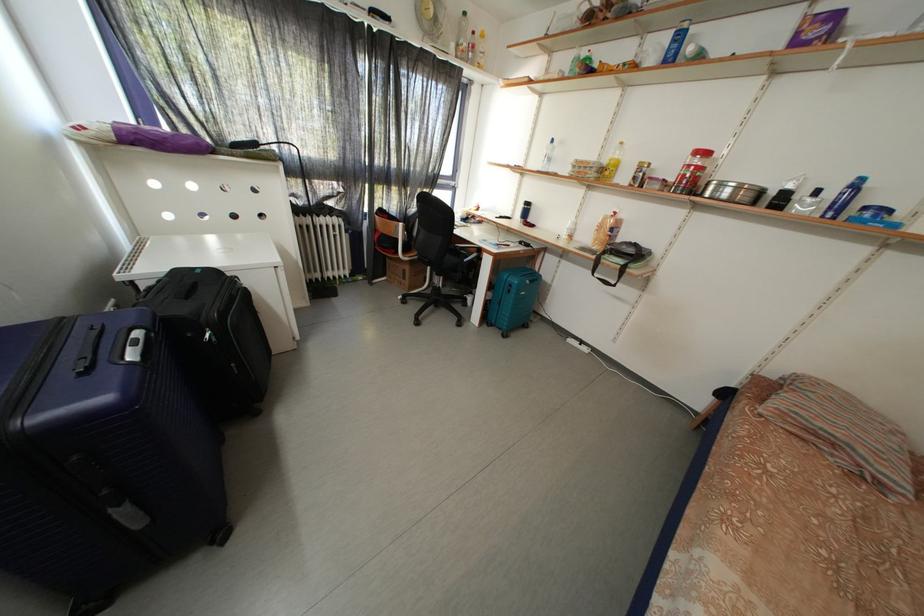
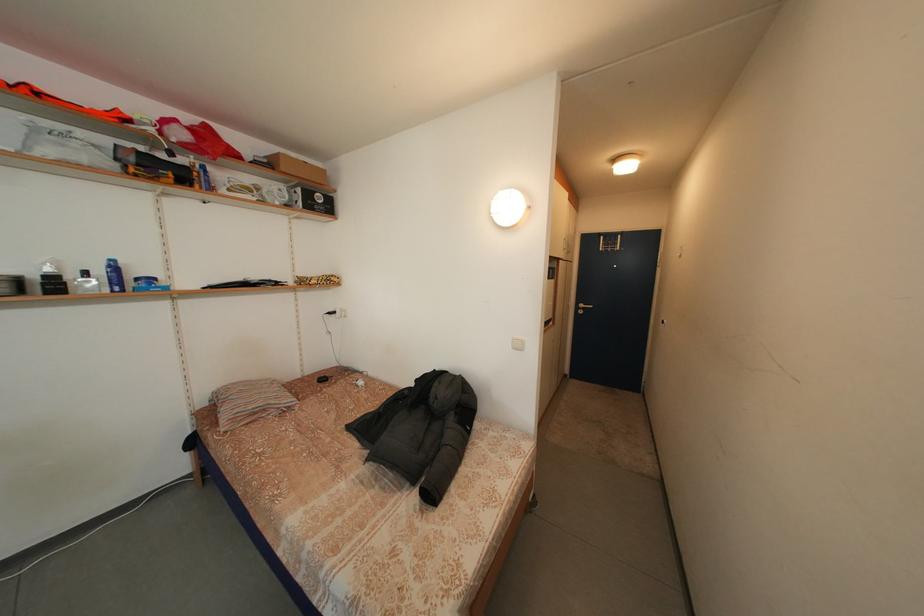
Find the pixel in the second image that matches (x=845, y=212) in the first image.

(125, 286)